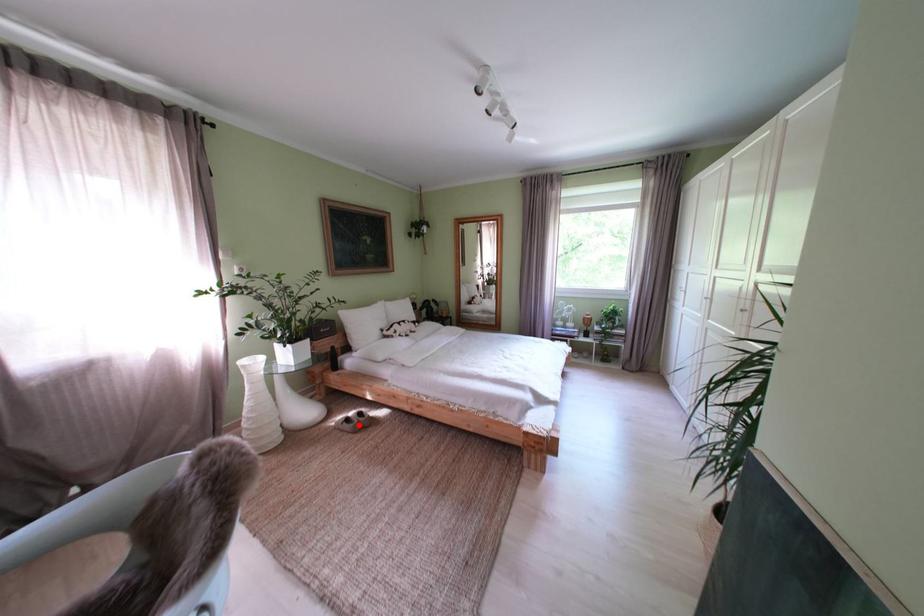
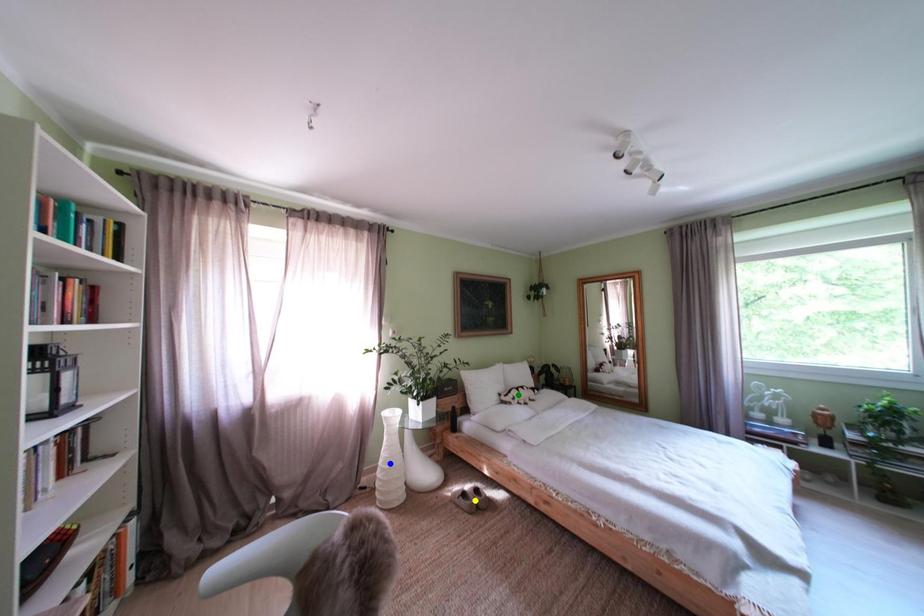
Question: I am providing you with two images of the same scene from different viewpoints. A red point is marked on the first image. You are given multiple points on the second image. In image 2, which mark is for the same physical point as the one in image 1?

Choices:
 (A) green point
 (B) yellow point
 (C) blue point

Answer: (B)